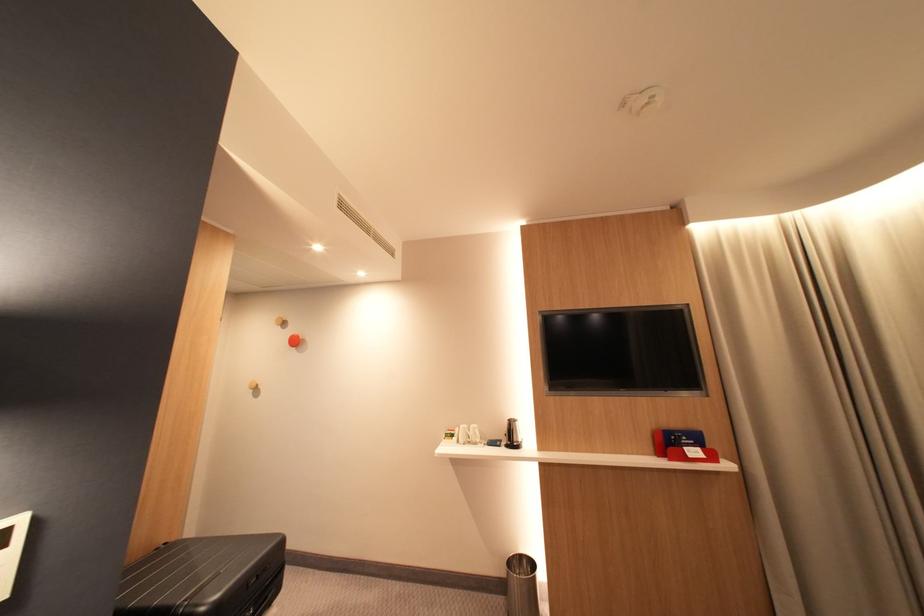
Find the location of `red wall hook`. red wall hook is located at coordinates (294, 339).